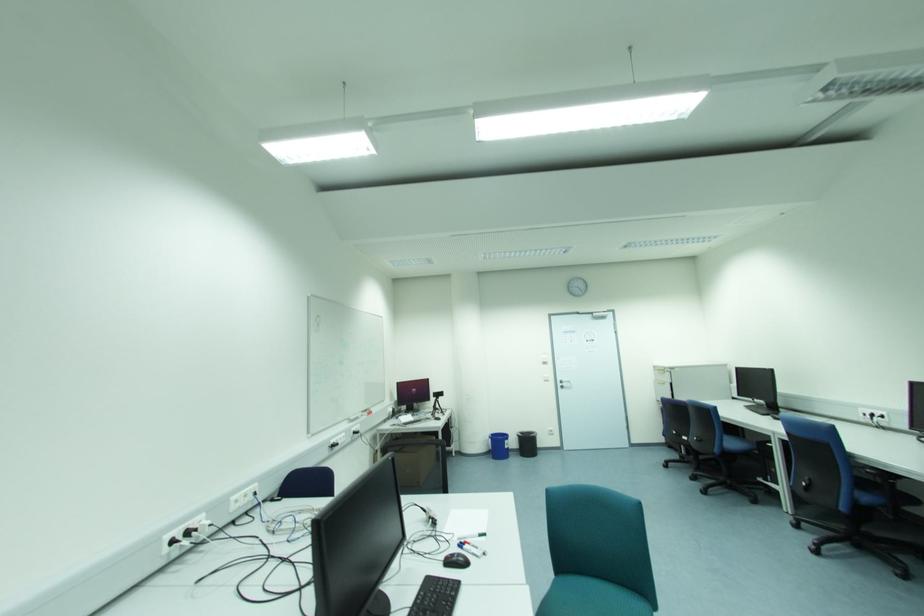
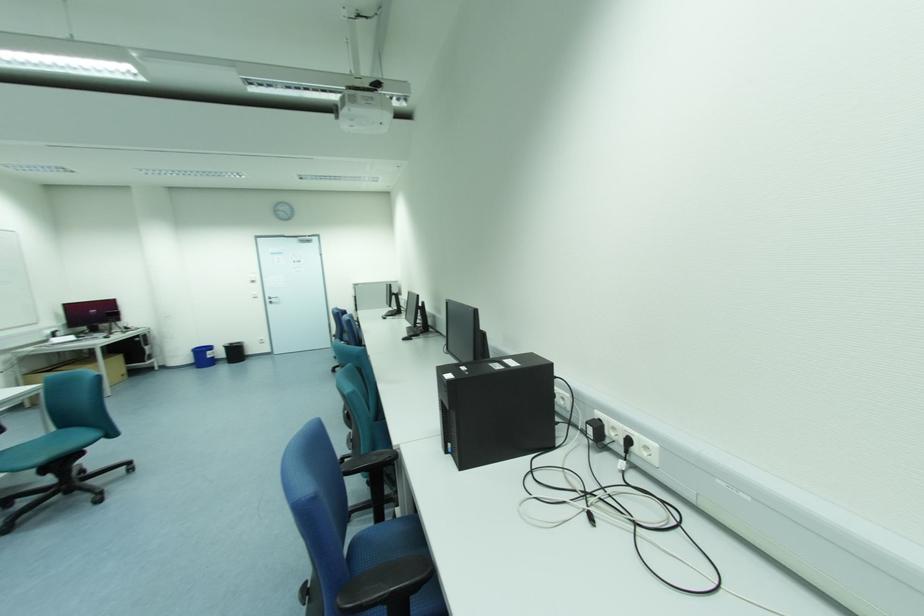
What movement of the cameraman would produce the second image?

The movement direction of the cameraman is right, backward.